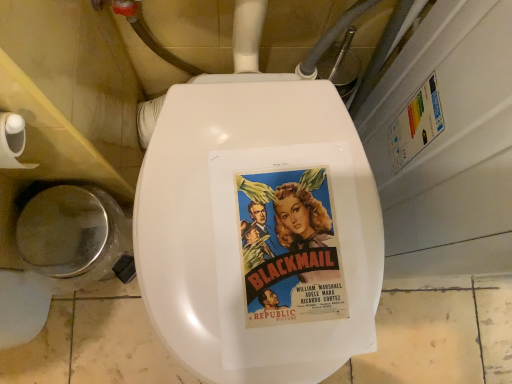
Question: Considering the positions of vintage paper poster at center and shiny silver lid at lower left in the image, is vintage paper poster at center bigger or smaller than shiny silver lid at lower left?

Choices:
 (A) small
 (B) big

Answer: (A)

Question: From a real-world perspective, relative to shiny silver lid at lower left, is vintage paper poster at center vertically above or below?

Choices:
 (A) below
 (B) above

Answer: (B)

Question: Considering the real-world distances, which object is farthest from the white matte toilet paper at left?

Choices:
 (A) vintage paper poster at center
 (B) shiny silver lid at lower left

Answer: (A)

Question: Estimate the real-world distances between objects in this image. Which object is farther from the white matte toilet paper at left?

Choices:
 (A) vintage paper poster at center
 (B) shiny silver lid at lower left

Answer: (A)